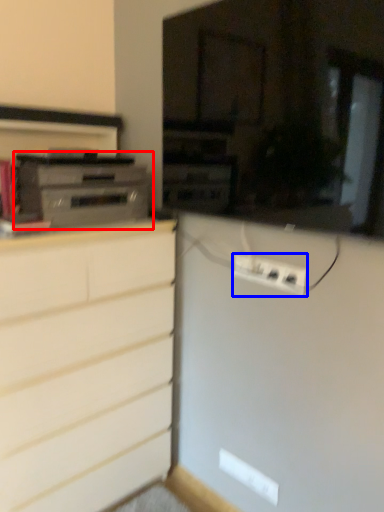
Question: Which of the following is the farthest to the observer, home appliance (highlighted by a red box) or electric outlet (highlighted by a blue box)?

Choices:
 (A) home appliance
 (B) electric outlet

Answer: (A)